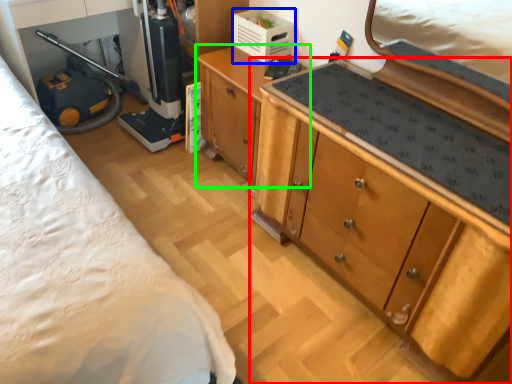
Question: Which is farther away from cabinetry (highlighted by a red box)? appliance (highlighted by a blue box) or cabinetry (highlighted by a green box)?

Choices:
 (A) appliance
 (B) cabinetry

Answer: (A)